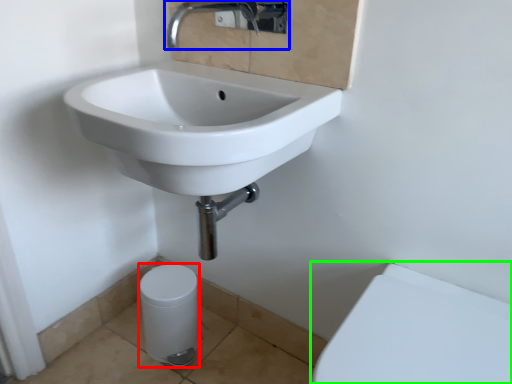
Question: Considering the real-world distances, which object is farthest from porcelain (highlighted by a red box)? tap (highlighted by a blue box) or porcelain (highlighted by a green box)?

Choices:
 (A) tap
 (B) porcelain

Answer: (A)